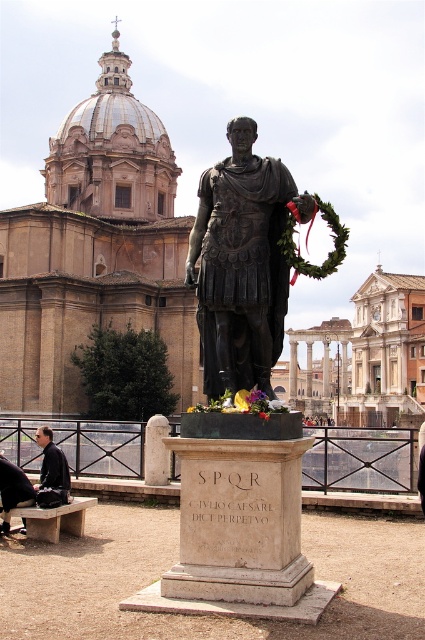
You are a tourist standing in front of the bronze statue at center and want to sit down to rest. The light gray stone bench at lower left is available. Can you walk directly to the bench without moving around any obstacles?

The bronze statue at center is above the light gray stone bench at lower left, so you can walk directly to the bench without needing to move around the statue since it is elevated and not blocking the path.

You are standing at the point marked as point (241, 262) in the image. What object is directly in front of you?

The bronze statue at center is directly in front of you at point (241, 262).

You are an art student visiting the site and want to sketch the bronze statue at center. You need to sit on the light gray stone bench at lower left to draw. Will the bench be wide enough for you to comfortably sit and sketch the entire statue without moving?

The bronze statue at center is wider than the light gray stone bench at lower left, so the bench may not be wide enough to comfortably sketch the entire statue without moving.